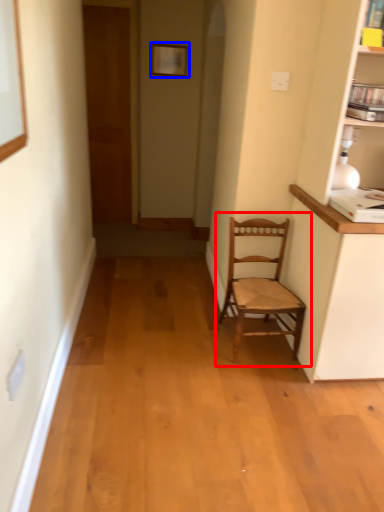
Question: Which object is closer to the camera taking this photo, chair (highlighted by a red box) or picture frame (highlighted by a blue box)?

Choices:
 (A) chair
 (B) picture frame

Answer: (A)